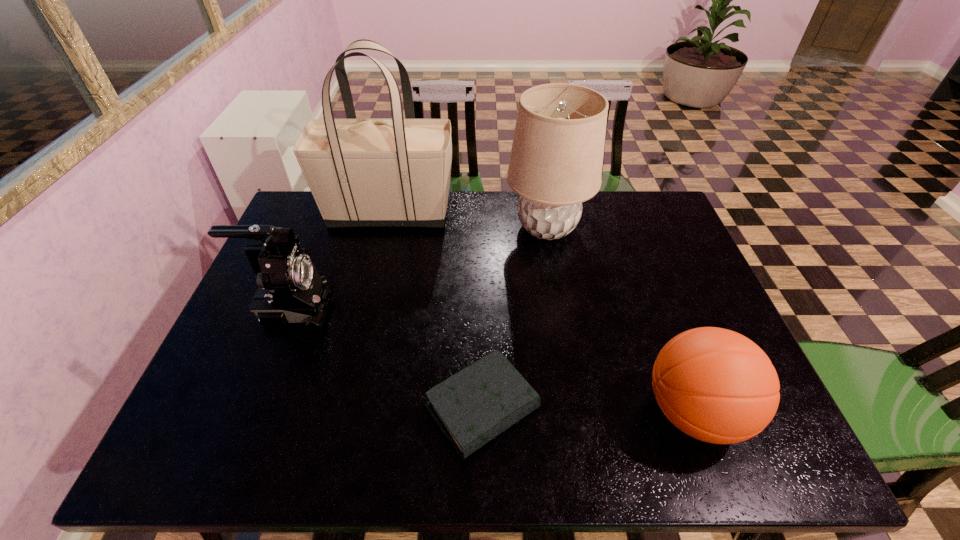
Find the location of `free region located 0.170m on the right of the shortest object`. free region located 0.170m on the right of the shortest object is located at coordinates click(616, 408).

The image size is (960, 540). Identify the location of shopping bag that is at the far edge. pos(395,172).

At what (x,y) coordinates should I click in order to perform the action: click on lampshade positioned at the far edge. Please return your answer as a coordinate pair (x, y). Looking at the image, I should click on (556, 160).

This screenshot has width=960, height=540. In order to click on basketball that is at the near edge in this screenshot , I will do `click(715, 385)`.

The image size is (960, 540). In order to click on Bible that is at the near edge in this screenshot , I will do `click(473, 406)`.

Identify the location of shopping bag located at the left edge. This screenshot has height=540, width=960. (395, 172).

The width and height of the screenshot is (960, 540). Find the location of `camcorder that is positioned at the left edge`. camcorder that is positioned at the left edge is located at coordinates (290, 290).

In order to click on object that is at the right edge in this screenshot , I will do `click(715, 385)`.

You are a GUI agent. You are given a task and a screenshot of the screen. Output one action in this format:
    pyautogui.click(x=<x>, y=<y>)
    Task: Click on the object that is at the far left corner
    
    Given the screenshot: What is the action you would take?
    pyautogui.click(x=395, y=172)

Where is `object situated at the near right corner`? The height and width of the screenshot is (540, 960). object situated at the near right corner is located at coordinates pyautogui.click(x=715, y=385).